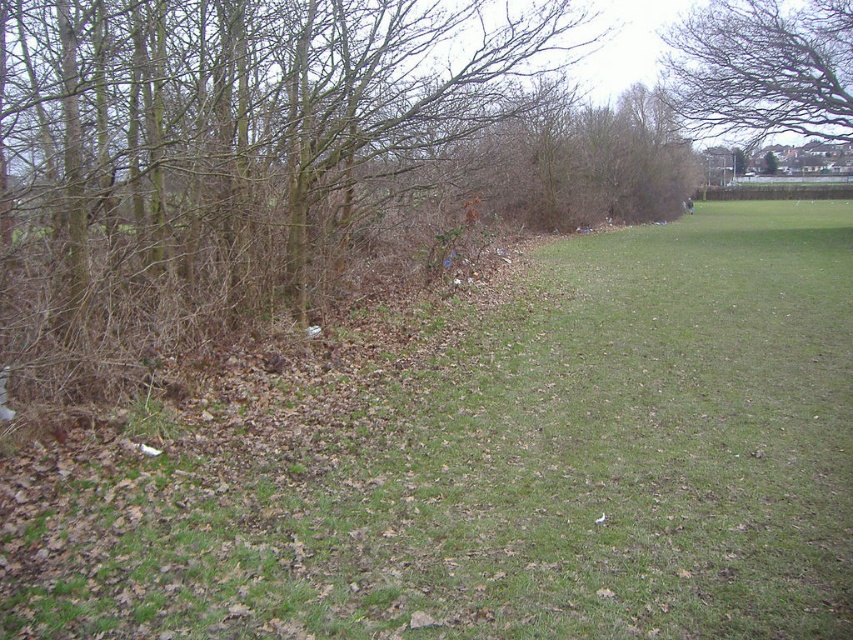
You are standing in the grassy area and looking towards the dense line of trees. Which object, the green grassy at left or the bare branches at upper center, is closer to the ground?

The green grassy at left is closer to the ground since it is shorter than the bare branches at upper center.